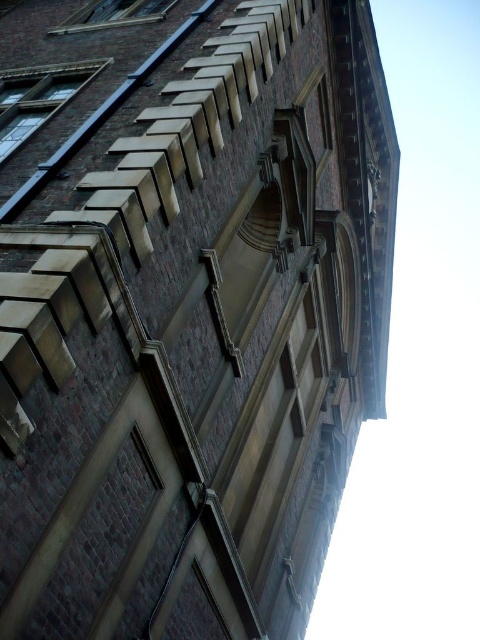
You are a window installer assessing the brick building. You have two windows to install at the upper left corner. The matte brick window at upper left and the clear glass window at upper left. Which window should you choose to fit in the smaller space available?

The matte brick window at upper left is smaller than the clear glass window at upper left, so you should choose the matte brick window at upper left to fit in the smaller space available.

You are an architect analyzing the brick building. You notice two windows at the upper left corner. Which one is more to the left side between the matte brick window at upper left and the clear glass window at upper left?

The matte brick window at upper left is more to the left side of the clear glass window at upper left as per their positions.

You are a window installer assessing the building facade. You need to replace the matte brick window at upper left and the clear glass window at upper left. Which window requires a narrower frame for its replacement?

The matte brick window at upper left requires a narrower frame because it is thinner than the clear glass window at upper left.